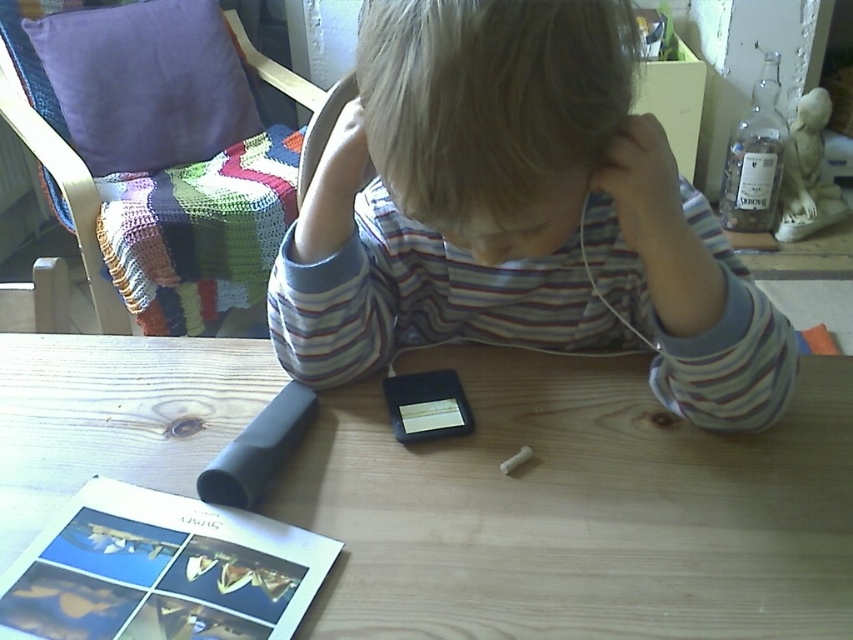
Identify the location of striped cotton shirt at center. (x=517, y=212).

Who is more forward, (x=584, y=65) or (x=457, y=60)?

Point (x=457, y=60) is in front.

At what (x,y) coordinates should I click in order to perform the action: click on striped cotton shirt at center. Please return your answer as a coordinate pair (x, y). This screenshot has height=640, width=853. Looking at the image, I should click on coord(517,212).

Between wooden table at center and striped cotton shirt at center, which one is positioned higher?

striped cotton shirt at center

Does point (135, 438) come in front of point (654, 186)?

No, it is not.

Locate an element on the screen. wooden table at center is located at coordinates (578, 509).

Is point (422, 477) positioned after point (535, 35)?

Yes, it is behind point (535, 35).

The height and width of the screenshot is (640, 853). What are the coordinates of `wooden table at center` in the screenshot? It's located at (578, 509).